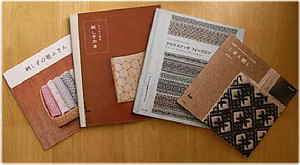
The width and height of the screenshot is (300, 165). Find the location of `books`. books is located at coordinates (60, 67), (102, 43), (174, 68), (221, 77).